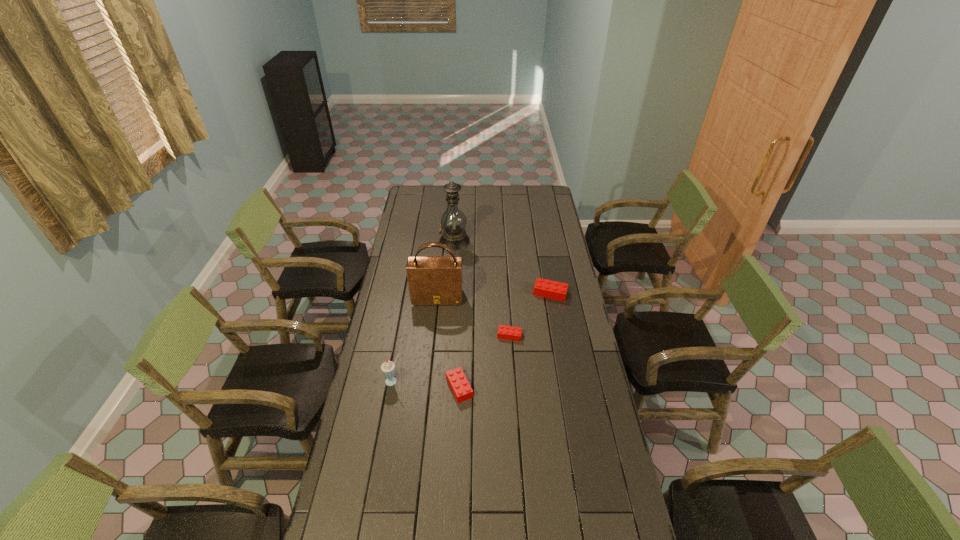
The width and height of the screenshot is (960, 540). In order to click on free space located on the back of the shortest object in this screenshot , I will do `click(507, 298)`.

Locate an element on the screen. The image size is (960, 540). vacant space positioned 0.310m on the front of the farthest Lego is located at coordinates (561, 354).

I want to click on vacant region located on the front flap of the second tallest object, so click(x=432, y=353).

Image resolution: width=960 pixels, height=540 pixels. What are the coordinates of `vacant space located 0.190m on the left of the farthest object` in the screenshot? It's located at (405, 241).

The width and height of the screenshot is (960, 540). I want to click on vacant space located 0.090m on the straw side of the third tallest object, so click(x=389, y=407).

The height and width of the screenshot is (540, 960). I want to click on shoulder bag located in the left edge section of the desktop, so click(432, 280).

You are a GUI agent. You are given a task and a screenshot of the screen. Output one action in this format:
    pyautogui.click(x=<x>, y=<y>)
    Task: Click on the milkshake present at the left edge
    This screenshot has height=540, width=960.
    Given the screenshot: What is the action you would take?
    pyautogui.click(x=388, y=368)

Image resolution: width=960 pixels, height=540 pixels. In order to click on object situated at the right edge in this screenshot , I will do `click(555, 290)`.

In the image, there is a desktop. Where is `vacant space at the far edge`? vacant space at the far edge is located at coordinates (509, 199).

You are a GUI agent. You are given a task and a screenshot of the screen. Output one action in this format:
    pyautogui.click(x=<x>, y=<y>)
    Task: Click on the free spot at the left edge of the desktop
    
    Given the screenshot: What is the action you would take?
    pyautogui.click(x=398, y=319)